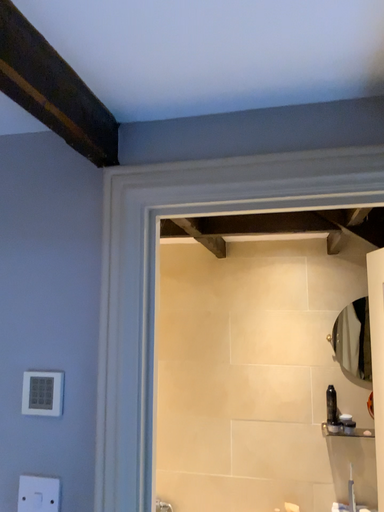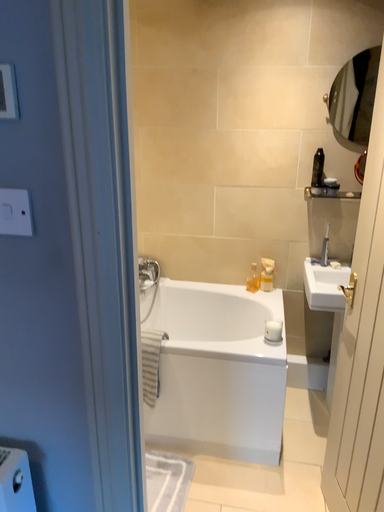
Question: Which way did the camera rotate in the video?

Choices:
 (A) rotated upward
 (B) rotated downward

Answer: (B)